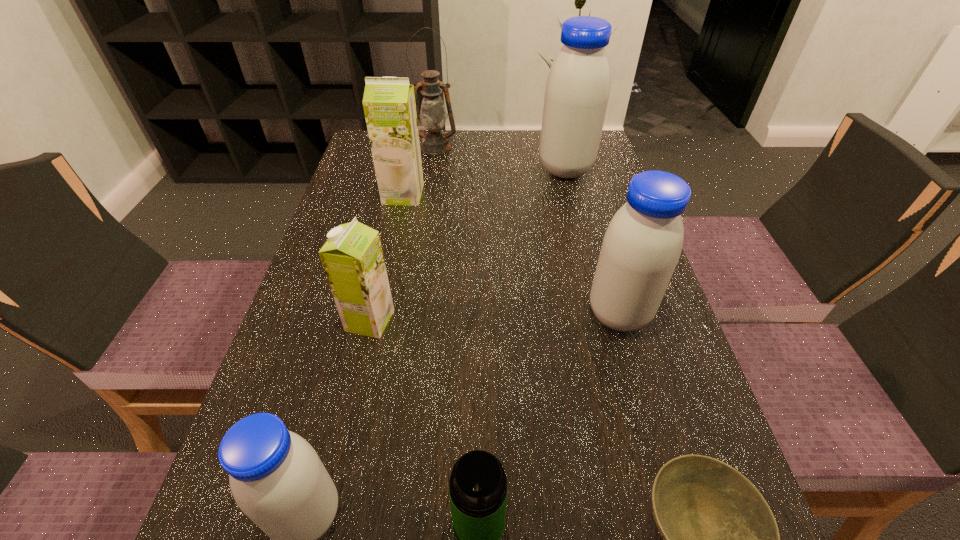
Where is `free region located 0.300m on the back of the nearer green soya milk`? The width and height of the screenshot is (960, 540). free region located 0.300m on the back of the nearer green soya milk is located at coordinates (395, 213).

Identify the location of soya milk that is at the far edge. The width and height of the screenshot is (960, 540). (577, 90).

The image size is (960, 540). I want to click on oil lamp positioned at the far edge, so click(433, 116).

The height and width of the screenshot is (540, 960). Find the location of `object present at the far right corner`. object present at the far right corner is located at coordinates (577, 90).

In the image, there is a desktop. Where is `vacant space at the far edge`? vacant space at the far edge is located at coordinates (465, 152).

Identify the location of vacant space at the left edge of the desktop. (350, 336).

The height and width of the screenshot is (540, 960). In the image, there is a desktop. In order to click on vacant space at the right edge in this screenshot , I will do `click(612, 438)`.

In order to click on free space between the smaller green soya milk and the oil lamp in this screenshot , I will do `click(403, 234)`.

Find the location of a particular element. This screenshot has height=540, width=960. blank region between the oil lamp and the farthest blue soya milk is located at coordinates (500, 158).

Where is `vacant point located between the oil lamp and the nearer green soya milk`? vacant point located between the oil lamp and the nearer green soya milk is located at coordinates (403, 234).